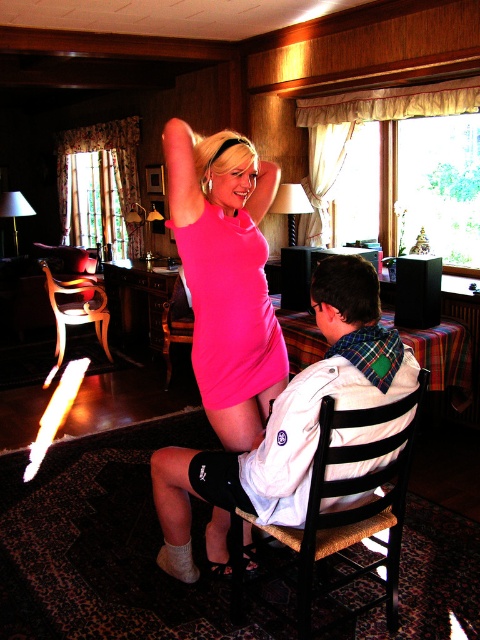
Question: Is pink matte dress at upper center thinner than white cotton jacket at center?

Choices:
 (A) no
 (B) yes

Answer: (B)

Question: Which point is closer to the camera taking this photo?

Choices:
 (A) (295, 516)
 (B) (220, 333)

Answer: (A)

Question: Does white cotton jacket at center come behind matte pink dress at center?

Choices:
 (A) yes
 (B) no

Answer: (B)

Question: Which object is closer to the camera taking this photo?

Choices:
 (A) pink matte dress at upper center
 (B) white cotton jacket at center

Answer: (B)

Question: Can you confirm if white cotton jacket at center is smaller than matte pink dress at center?

Choices:
 (A) no
 (B) yes

Answer: (A)

Question: Which point appears farthest from the camera in this image?

Choices:
 (A) (220, 376)
 (B) (60, 284)
 (C) (397, 445)
 (D) (274, 513)

Answer: (B)